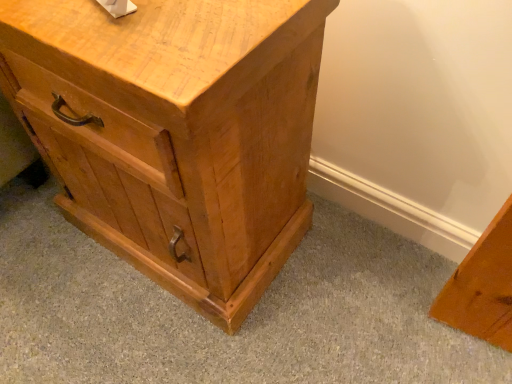
Locate an element on the screen. This screenshot has height=384, width=512. vacant space in front of natural wood cabinet at center is located at coordinates (165, 334).